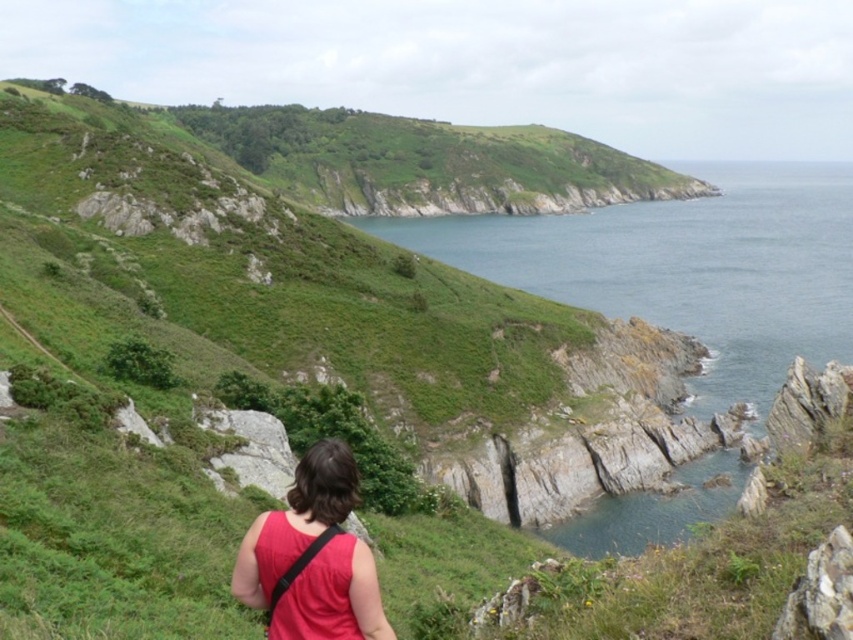
Question: Is blue water at upper right positioned in front of red matte tank top at lower center?

Choices:
 (A) yes
 (B) no

Answer: (B)

Question: Among these points, which one is nearest to the camera?

Choices:
 (A) (328, 470)
 (B) (502, 225)

Answer: (A)

Question: Which point is farther from the camera taking this photo?

Choices:
 (A) (274, 552)
 (B) (851, 307)

Answer: (B)

Question: Can you confirm if blue water at upper right is wider than red matte tank top at lower center?

Choices:
 (A) yes
 (B) no

Answer: (A)

Question: Among these points, which one is nearest to the camera?

Choices:
 (A) (331, 472)
 (B) (573, 228)

Answer: (A)

Question: Is blue water at upper right bigger than red matte tank top at lower center?

Choices:
 (A) yes
 (B) no

Answer: (A)